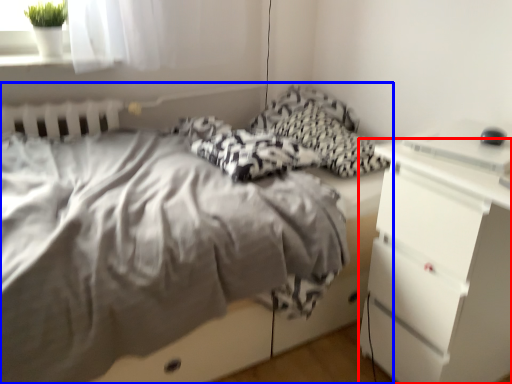
Question: Which point is further to the camera, chest of drawers (highlighted by a red box) or bed (highlighted by a blue box)?

Choices:
 (A) chest of drawers
 (B) bed

Answer: (A)